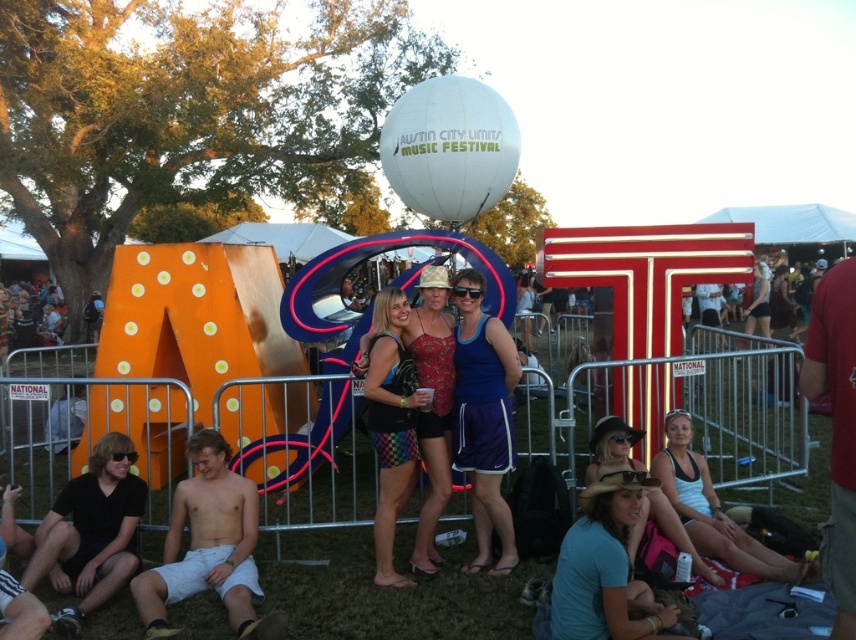
You are a photographer at the Austin City Limits Music Festival. You want to take a photo of the blue fabric skirt at center and the rainbow checkered shorts at center. From the perspective of the photographer facing the subjects, which object is positioned to the left?

The rainbow checkered shorts at center is positioned to the left of the blue fabric skirt at center.

You are at the Austin City Limits Music Festival and want to take a photo of both the point at coordinates (459, 337) and the point at coordinates (409, 429). Which point should you focus on first to ensure both are in focus?

You should focus on the point at coordinates (459, 337) first because it is closer to the camera than the point at coordinates (409, 429). This ensures that both points will be in focus when taking the photo.

You are a photographer at the festival and want to capture both the rainbow checkered shorts at center and the white tank top at lower right in the same frame. Which object should you focus on first to ensure both are in focus?

You should focus on the rainbow checkered shorts at center first since it is larger in size compared to the white tank top at lower right, ensuring both will be in focus.